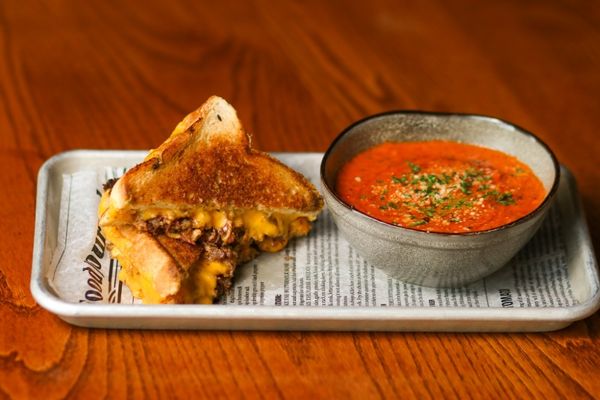
You are a GUI agent. You are given a task and a screenshot of the screen. Output one action in this format:
    pyautogui.click(x=<x>, y=<y>)
    Task: Click on the newspaper
    The width and height of the screenshot is (600, 400).
    Given the screenshot: What is the action you would take?
    pyautogui.click(x=338, y=274)